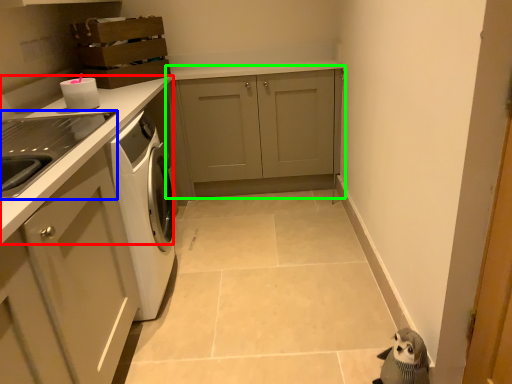
Question: Which object is the closest to the countertop (highlighted by a red box)? Choose among these: home appliance (highlighted by a blue box) or cabinetry (highlighted by a green box).

Choices:
 (A) home appliance
 (B) cabinetry

Answer: (A)